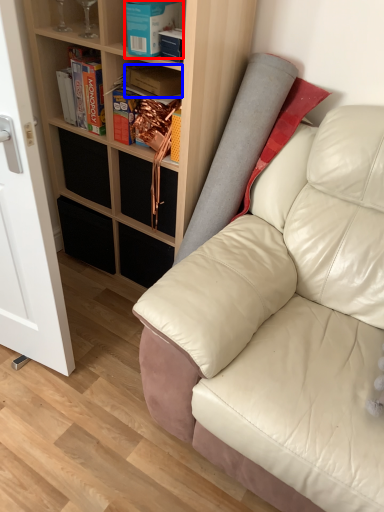
Question: Which object appears farthest to the camera in this image, book (highlighted by a red box) or book (highlighted by a blue box)?

Choices:
 (A) book
 (B) book

Answer: (B)